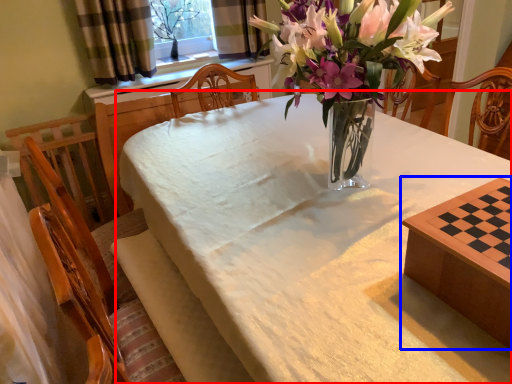
Question: Which point is further to the camera, table (highlighted by a red box) or table (highlighted by a blue box)?

Choices:
 (A) table
 (B) table

Answer: (B)